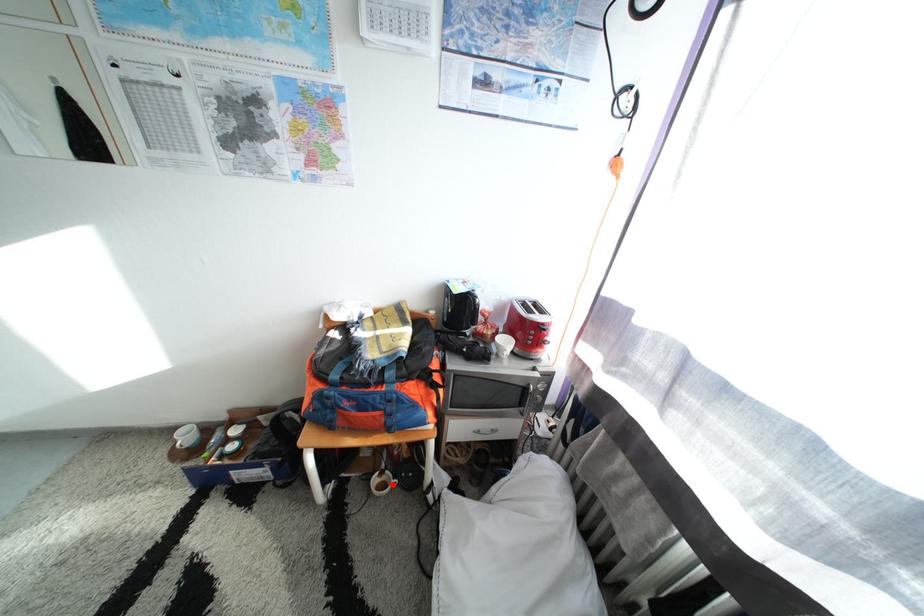
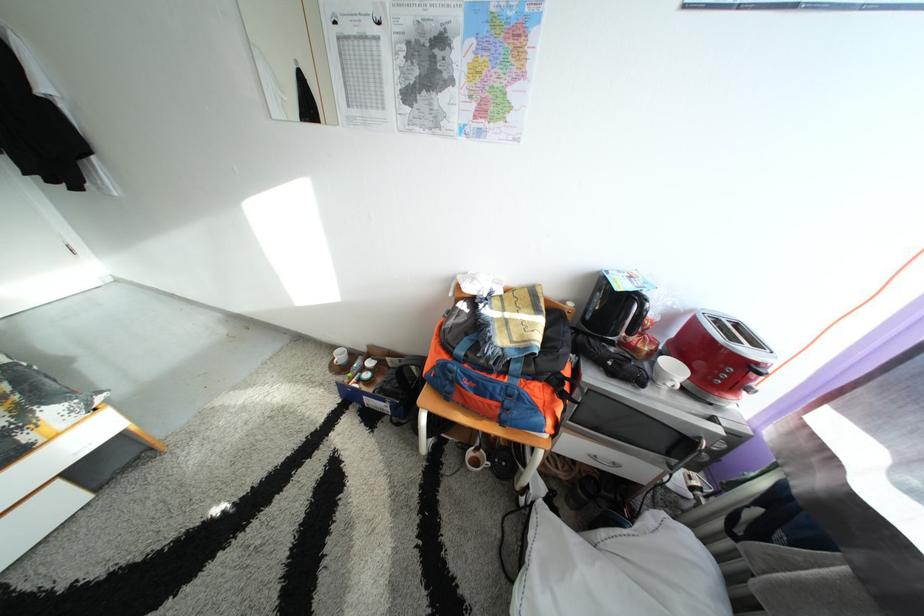
The point at the highlighted location is marked in the first image. Where is the corresponding point in the second image?

(487, 461)